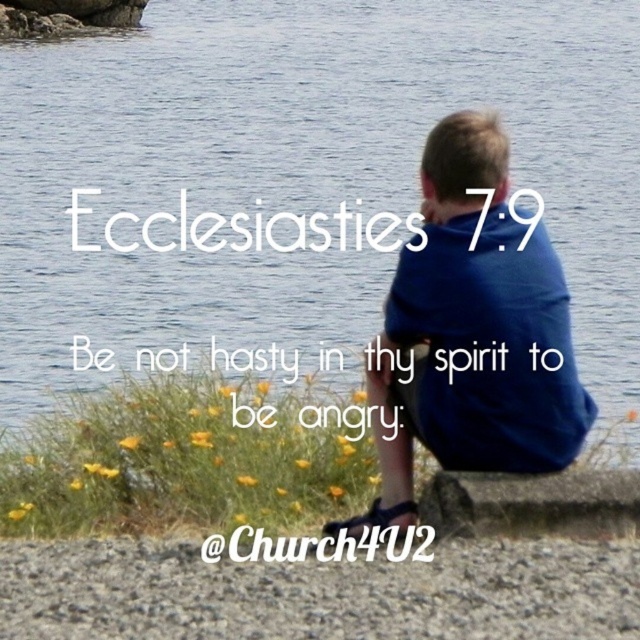
Question: Can you confirm if blue fabric shirt at center is positioned to the left of smooth gray stone at lower center?

Choices:
 (A) yes
 (B) no

Answer: (A)

Question: Which of the following is the farthest from the observer?

Choices:
 (A) (550, 486)
 (B) (396, 51)
 (C) (464, 241)

Answer: (B)

Question: Does transparent water at center have a larger size compared to smooth gray stone at lower center?

Choices:
 (A) yes
 (B) no

Answer: (A)

Question: Which point appears farthest from the camera in this image?

Choices:
 (A) (577, 493)
 (B) (508, 60)
 (C) (452, 116)

Answer: (B)

Question: Is blue fabric shirt at center further to the viewer compared to smooth gray stone at lower center?

Choices:
 (A) no
 (B) yes

Answer: (B)

Question: Which of the following is the farthest from the observer?

Choices:
 (A) smooth gray stone at lower center
 (B) transparent water at center
 (C) blue fabric shirt at center

Answer: (B)